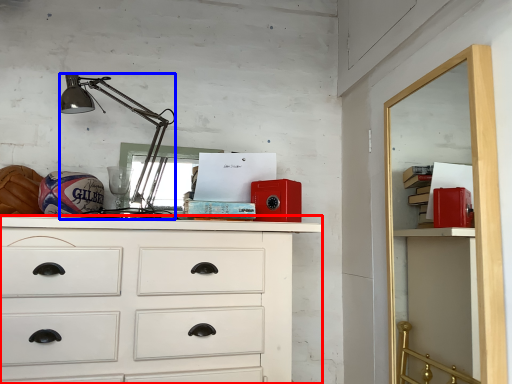
Question: Which point is closer to the camera, chest of drawers (highlighted by a red box) or lamp (highlighted by a blue box)?

Choices:
 (A) chest of drawers
 (B) lamp

Answer: (A)